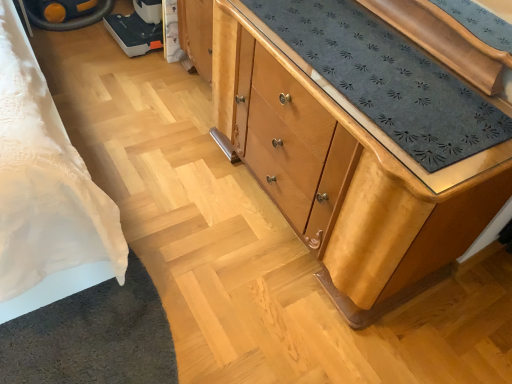
Image resolution: width=512 pixels, height=384 pixels. In order to click on light brown wood chest of drawers at center in this screenshot , I will do `click(347, 168)`.

This screenshot has height=384, width=512. Describe the element at coordinates (347, 168) in the screenshot. I see `light brown wood chest of drawers at center` at that location.

The image size is (512, 384). What do you see at coordinates (70, 20) in the screenshot? I see `yellow rubber wheel at upper left` at bounding box center [70, 20].

In the scene shown: Measure the distance between point (109, 8) and camera.

Point (109, 8) is 2.50 meters from camera.

Find the location of a particular element. This screenshot has height=384, width=512. yellow rubber wheel at upper left is located at coordinates (70, 20).

The height and width of the screenshot is (384, 512). Find the location of `light brown wood chest of drawers at center`. light brown wood chest of drawers at center is located at coordinates (347, 168).

Visually, is yellow rubber wheel at upper left positioned to the left or to the right of light brown wood chest of drawers at center?

Clearly, yellow rubber wheel at upper left is on the left of light brown wood chest of drawers at center in the image.

In the image, is yellow rubber wheel at upper left positioned in front of or behind light brown wood chest of drawers at center?

yellow rubber wheel at upper left is positioned farther from the viewer than light brown wood chest of drawers at center.

Which point is more distant from viewer, [31,23] or [334,100]?

The point [31,23] is more distant.

From the image's perspective, relative to light brown wood chest of drawers at center, is yellow rubber wheel at upper left above or below?

From the image's perspective, yellow rubber wheel at upper left appears above light brown wood chest of drawers at center.

From a real-world perspective, is yellow rubber wheel at upper left positioned above or below light brown wood chest of drawers at center?

Clearly, from a real-world perspective, yellow rubber wheel at upper left is below light brown wood chest of drawers at center.

Considering the sizes of objects yellow rubber wheel at upper left and light brown wood chest of drawers at center in the image provided, who is thinner, yellow rubber wheel at upper left or light brown wood chest of drawers at center?

Thinner between the two is light brown wood chest of drawers at center.

Considering the sizes of yellow rubber wheel at upper left and light brown wood chest of drawers at center in the image, is yellow rubber wheel at upper left taller or shorter than light brown wood chest of drawers at center?

yellow rubber wheel at upper left is shorter than light brown wood chest of drawers at center.

Is yellow rubber wheel at upper left smaller than light brown wood chest of drawers at center?

Yes.

Is yellow rubber wheel at upper left not within light brown wood chest of drawers at center?

That's correct, yellow rubber wheel at upper left is outside of light brown wood chest of drawers at center.

Is yellow rubber wheel at upper left far from light brown wood chest of drawers at center?

yellow rubber wheel at upper left is far away from light brown wood chest of drawers at center.

Is yellow rubber wheel at upper left oriented towards light brown wood chest of drawers at center?

Yes.

From the picture: How different are the orientations of yellow rubber wheel at upper left and light brown wood chest of drawers at center in degrees?

92.1 degrees.

Measure the distance from yellow rubber wheel at upper left to light brown wood chest of drawers at center.

A distance of 6.01 feet exists between yellow rubber wheel at upper left and light brown wood chest of drawers at center.

At what (x,y) coordinates should I click in order to perform the action: click on wheel above the light brown wood chest of drawers at center (from the image's perspective). Please return your answer as a coordinate pair (x, y). Looking at the image, I should click on (70, 20).

Visually, is light brown wood chest of drawers at center positioned to the left or to the right of yellow rubber wheel at upper left?

light brown wood chest of drawers at center is to the right of yellow rubber wheel at upper left.

Is light brown wood chest of drawers at center in front of or behind yellow rubber wheel at upper left in the image?

light brown wood chest of drawers at center is positioned closer to the viewer than yellow rubber wheel at upper left.

Between point (248, 52) and point (98, 14), which one is positioned behind?

The point (98, 14) is behind.

From the image's perspective, is light brown wood chest of drawers at center located above or below yellow rubber wheel at upper left?

light brown wood chest of drawers at center is below yellow rubber wheel at upper left.

From a real-world perspective, is light brown wood chest of drawers at center under yellow rubber wheel at upper left?

Incorrect, from a real-world perspective, light brown wood chest of drawers at center is higher than yellow rubber wheel at upper left.

Can you confirm if light brown wood chest of drawers at center is thinner than yellow rubber wheel at upper left?

Yes, light brown wood chest of drawers at center is thinner than yellow rubber wheel at upper left.

Does light brown wood chest of drawers at center have a lesser height compared to yellow rubber wheel at upper left?

In fact, light brown wood chest of drawers at center may be taller than yellow rubber wheel at upper left.

Does light brown wood chest of drawers at center have a larger size compared to yellow rubber wheel at upper left?

Yes, light brown wood chest of drawers at center is bigger than yellow rubber wheel at upper left.

Is light brown wood chest of drawers at center inside or outside of yellow rubber wheel at upper left?

light brown wood chest of drawers at center lies outside yellow rubber wheel at upper left.

Are light brown wood chest of drawers at center and yellow rubber wheel at upper left located far from each other?

Indeed, light brown wood chest of drawers at center is not near yellow rubber wheel at upper left.

Is light brown wood chest of drawers at center oriented away from yellow rubber wheel at upper left?

No.

How many degrees apart are the facing directions of light brown wood chest of drawers at center and yellow rubber wheel at upper left?

There is a 92.1-degree angle between the facing directions of light brown wood chest of drawers at center and yellow rubber wheel at upper left.

Measure the distance from light brown wood chest of drawers at center to yellow rubber wheel at upper left.

1.83 meters.

This screenshot has width=512, height=384. What are the coordinates of `chest of drawers on the right of yellow rubber wheel at upper left` in the screenshot? It's located at (347, 168).

Where is `the chest of drawers in front of the yellow rubber wheel at upper left`? The image size is (512, 384). the chest of drawers in front of the yellow rubber wheel at upper left is located at coordinates (347, 168).

Locate an element on the screen. chest of drawers on the right of yellow rubber wheel at upper left is located at coordinates (347, 168).